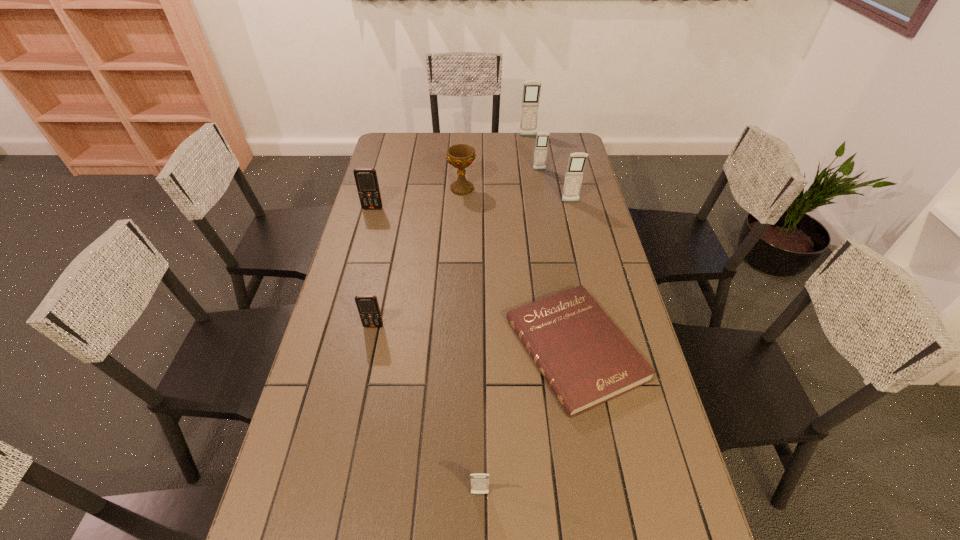
At what (x,y) coordinates should I click in order to perform the action: click on the second cellular telephone from left to right. Please return your answer as a coordinate pair (x, y). The image size is (960, 540). Looking at the image, I should click on (367, 305).

Image resolution: width=960 pixels, height=540 pixels. I want to click on the right orange cellular telephone, so click(367, 305).

Locate an element on the screen. The image size is (960, 540). the fourth cellular telephone from right to left is located at coordinates (479, 482).

I want to click on the leftmost gray cellular telephone, so click(479, 482).

This screenshot has width=960, height=540. I want to click on hardback book, so click(585, 358).

Where is `vacant region located 0.320m on the front-facing side of the farthest object`? This screenshot has height=540, width=960. vacant region located 0.320m on the front-facing side of the farthest object is located at coordinates (534, 176).

The height and width of the screenshot is (540, 960). In order to click on vacant space situated 0.150m on the front-facing side of the second tallest cellular telephone in this screenshot , I will do `click(577, 229)`.

What are the coordinates of `free location located on the front-facing side of the second smallest gray cellular telephone` in the screenshot? It's located at (546, 213).

At what (x,y) coordinates should I click in order to perform the action: click on vacant area situated on the screen of the farther orange cellular telephone. Please return your answer as a coordinate pair (x, y). The height and width of the screenshot is (540, 960). Looking at the image, I should click on (368, 225).

The width and height of the screenshot is (960, 540). What are the coordinates of `vacant region located on the left of the chalice` in the screenshot? It's located at (392, 189).